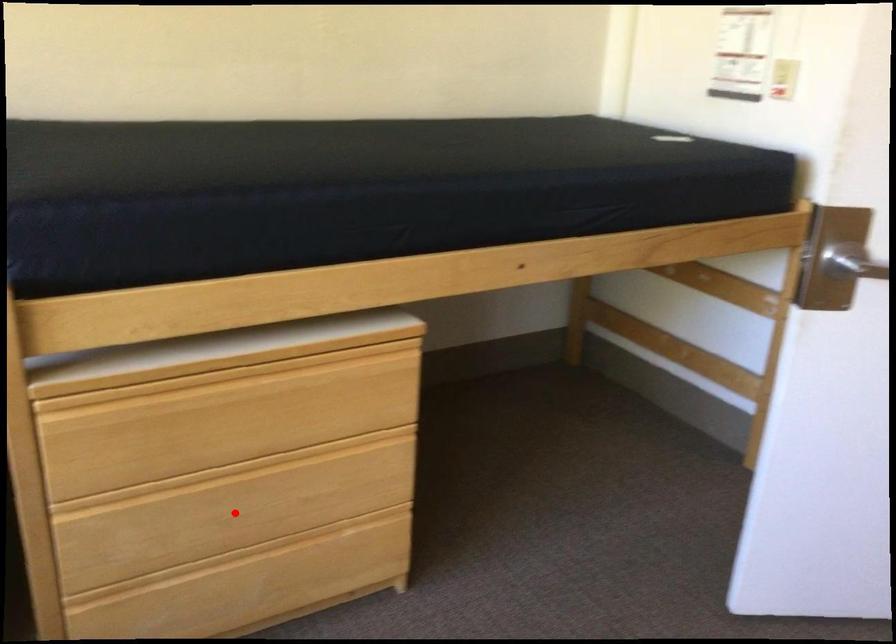
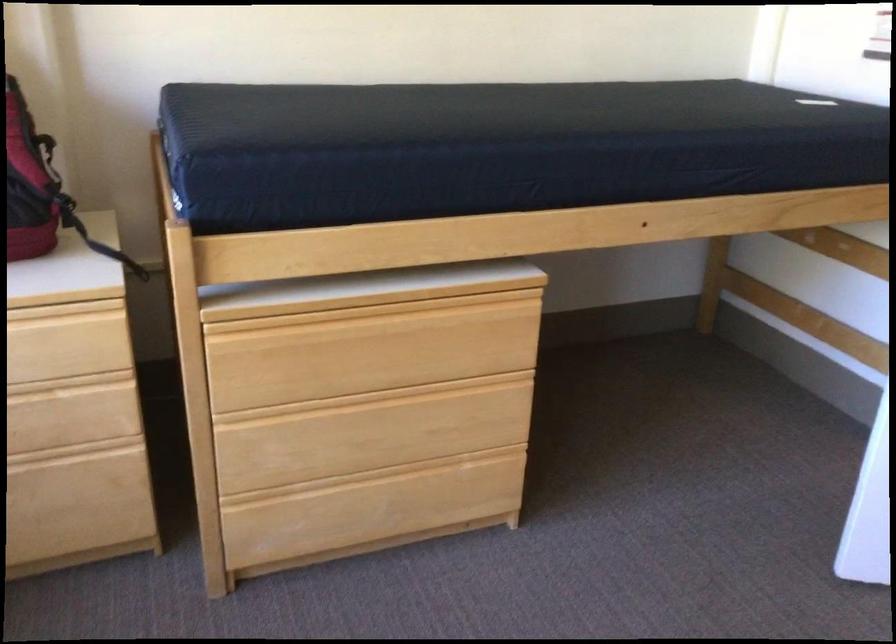
Question: I am providing you with two images of the same scene from different viewpoints. Given a red point in image1, look at the same physical point in image2. Is it:

Choices:
 (A) Closer to the viewpoint
 (B) Farther from the viewpoint

Answer: (B)